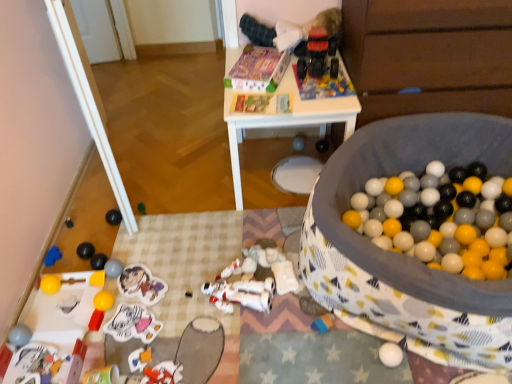
Where is `free point to the right of matte white sticker at center, the fourteenth toy when ordered from left to right`? free point to the right of matte white sticker at center, the fourteenth toy when ordered from left to right is located at coordinates (185, 326).